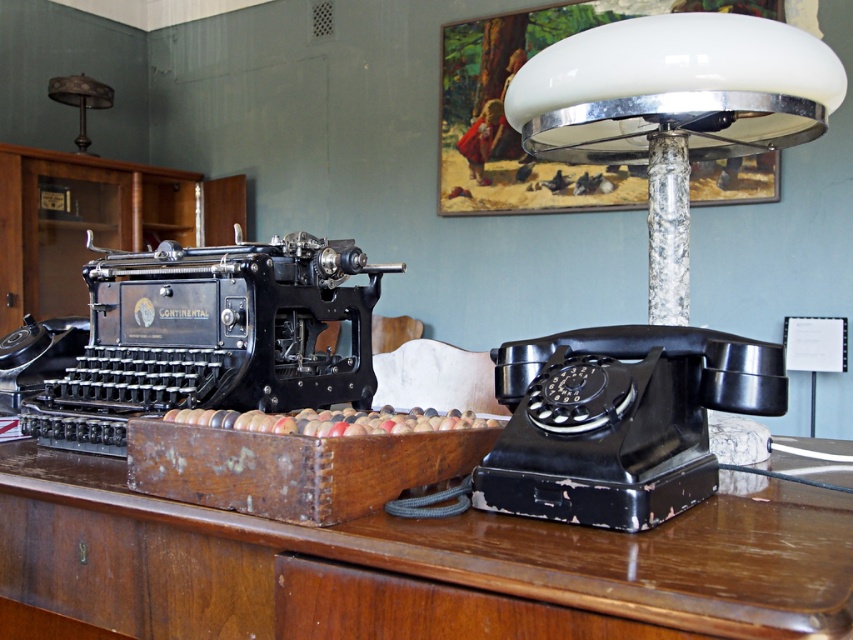
Does point (234, 292) come behind point (62, 88)?

No, (234, 292) is closer to viewer.

Who is higher up, black metal typewriter at left or metallic lampshade at upper left?

Positioned higher is metallic lampshade at upper left.

Which is in front, point (212, 262) or point (65, 97)?

Point (212, 262) is in front.

This screenshot has height=640, width=853. I want to click on black metal typewriter at left, so click(x=212, y=337).

Locate an element on the screen. black matte rotary phone at right is located at coordinates (619, 420).

Can you confirm if black matte rotary phone at right is positioned below metallic lampshade at upper left?

Correct, black matte rotary phone at right is located below metallic lampshade at upper left.

The image size is (853, 640). Identify the location of black matte rotary phone at right. (619, 420).

Does white glass lampshade at upper right appear under metallic lampshade at upper left?

Yes.

Which is below, white glass lampshade at upper right or metallic lampshade at upper left?

Positioned lower is white glass lampshade at upper right.

Identify the location of white glass lampshade at upper right. The image size is (853, 640). (674, 109).